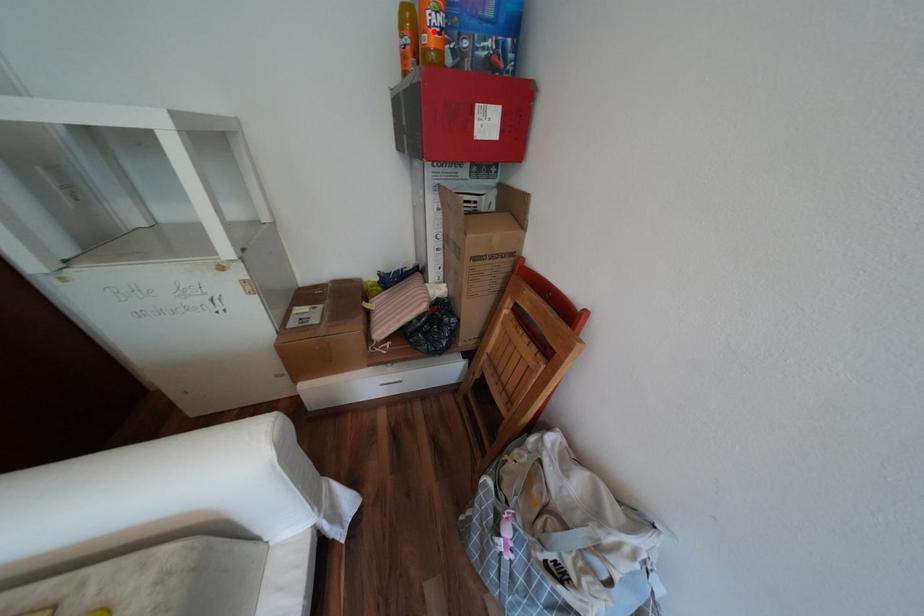
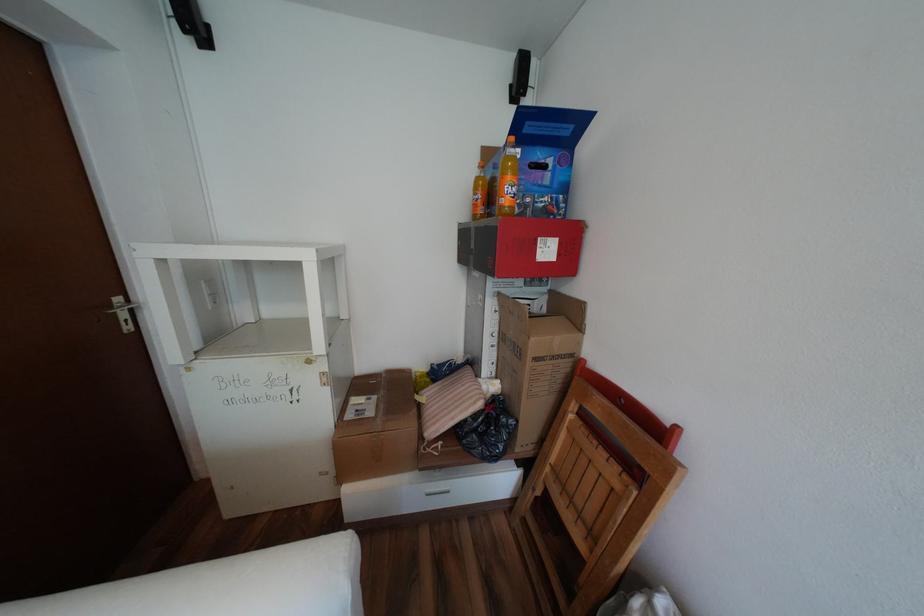
Locate, in the second image, the point that corresponds to the highlighted location in the first image.

(512, 197)